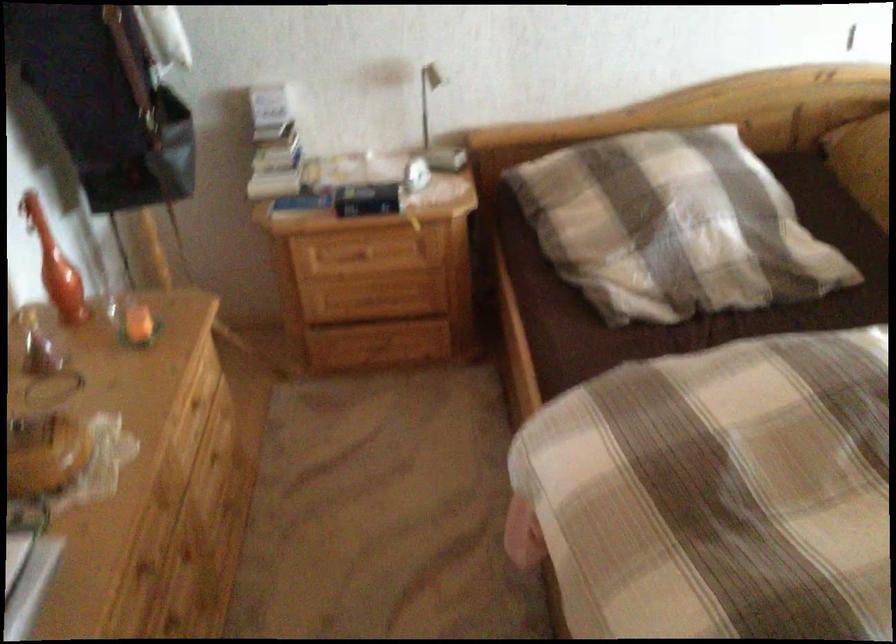
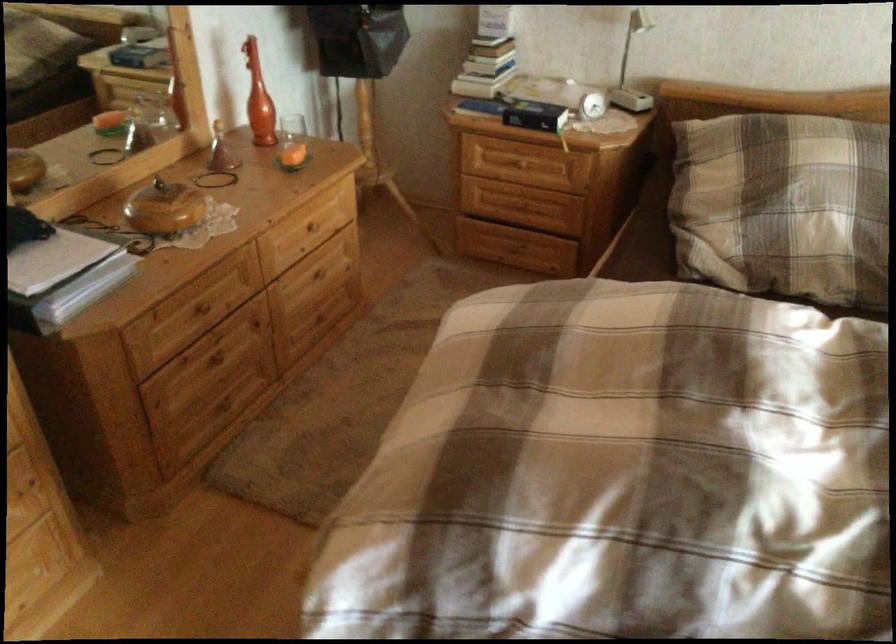
Where in the second image is the point corresponding to pixel 151 565 from the first image?

(207, 307)